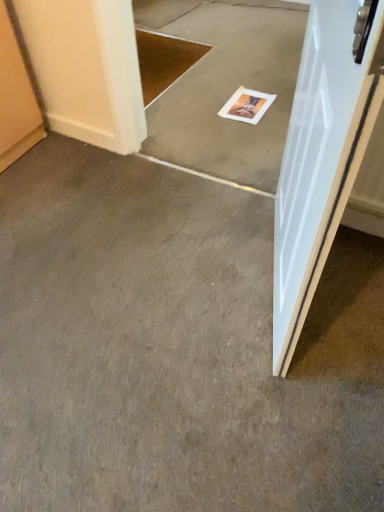
Question: Is white paper magazine at center inside the boundaries of gray carpet at center, the first concrete in the bottom-to-top sequence, or outside?

Choices:
 (A) inside
 (B) outside

Answer: (B)

Question: In terms of width, does white paper magazine at center look wider or thinner when compared to gray carpet at center, the first concrete in the bottom-to-top sequence?

Choices:
 (A) wide
 (B) thin

Answer: (B)

Question: Which object is positioned farthest from the white paper magazine at center?

Choices:
 (A) gray carpet at center, placed as the 2th concrete when sorted from top to bottom
 (B) white glossy door at right
 (C) smooth gray carpet at center, placed as the second concrete when sorted from bottom to top

Answer: (A)

Question: Which object is the closest to the white glossy door at right?

Choices:
 (A) gray carpet at center, placed as the 2th concrete when sorted from top to bottom
 (B) white paper magazine at center
 (C) smooth gray carpet at center, the 1th concrete in the top-to-bottom sequence

Answer: (A)